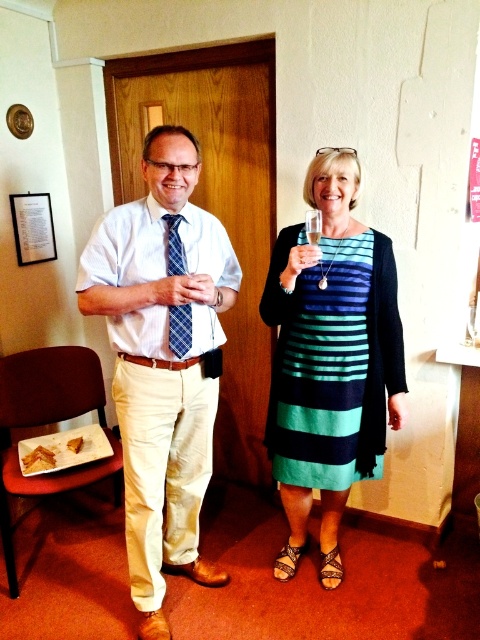
You are a photographer setting up for a group photo. You need to ensure that the matte blue tie at center and the teal striped dress at center are at least 40 centimeters apart to avoid overlapping in the frame. Based on the current positions, will they fit the requirement?

The matte blue tie at center and the teal striped dress at center are currently 36.99 centimeters apart, which is less than the required 40 centimeters. They need to move further apart to meet the distance requirement.